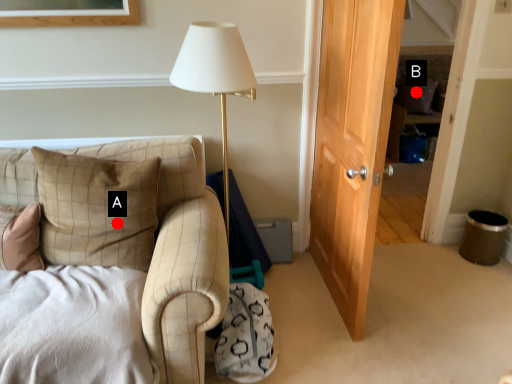
Question: Two points are circled on the image, labeled by A and B beside each circle. Which point is closer to the camera taking this photo?

Choices:
 (A) A is closer
 (B) B is closer

Answer: (A)